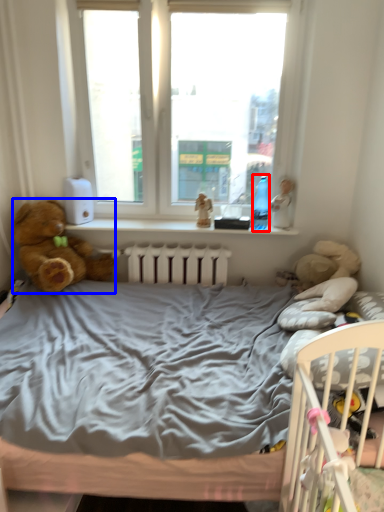
Question: Which object appears farthest to the camera in this image, bottle (highlighted by a red box) or teddy bear (highlighted by a blue box)?

Choices:
 (A) bottle
 (B) teddy bear

Answer: (A)